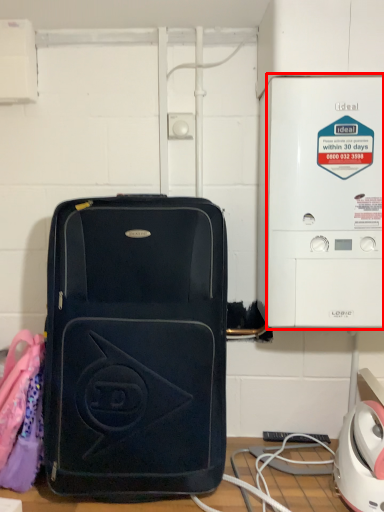
Question: From the image, what is the correct spatial relationship of appliance (annotated by the red box) in relation to luggage and bags?

Choices:
 (A) left
 (B) right

Answer: (B)